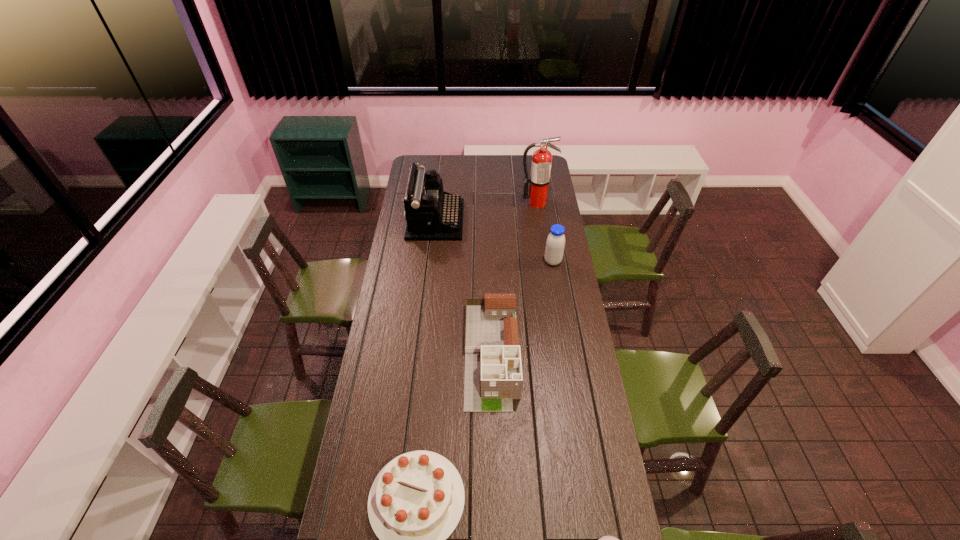
Where is `fire extinguisher`? This screenshot has height=540, width=960. fire extinguisher is located at coordinates 539,179.

Where is `typewriter`? Image resolution: width=960 pixels, height=540 pixels. typewriter is located at coordinates (432, 214).

You are a GUI agent. You are given a task and a screenshot of the screen. Output one action in this format:
    pyautogui.click(x=<x>, y=<y>)
    Task: Click on the soya milk
    This screenshot has height=540, width=960.
    Given the screenshot: What is the action you would take?
    pyautogui.click(x=555, y=243)

Find the location of a particular element. This screenshot has width=960, height=540. the third farthest object is located at coordinates click(555, 243).

I want to click on dollhouse, so click(493, 371).

Locate an element on the screen. This screenshot has width=960, height=540. the fourth tallest object is located at coordinates (493, 371).

The height and width of the screenshot is (540, 960). In order to click on free space located 0.130m on the nozzle side of the fire extinguisher in this screenshot , I will do `click(540, 222)`.

At what (x,y) coordinates should I click in order to perform the action: click on vacant space located 0.270m on the typing side of the fifth shortest object. Please return your answer as a coordinate pair (x, y). Image resolution: width=960 pixels, height=540 pixels. Looking at the image, I should click on (512, 220).

You are a GUI agent. You are given a task and a screenshot of the screen. Output one action in this format:
    pyautogui.click(x=<x>, y=<y>)
    Task: Click on the vacant space located 0.160m on the back of the fourth shortest object
    This screenshot has height=540, width=960.
    Given the screenshot: What is the action you would take?
    pyautogui.click(x=548, y=235)

The image size is (960, 540). What are the coordinates of `free space located at the main entrance of the fourth tallest object` in the screenshot? It's located at (493, 441).